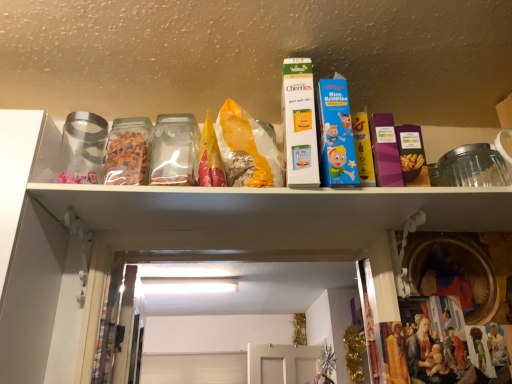
The height and width of the screenshot is (384, 512). I want to click on white cardboard cheerios box at upper center, which is the first product in left-to-right order, so click(298, 124).

Where is `blue cardboard rice krispies cereal box at center, which is the second product in left-to-right order`? The height and width of the screenshot is (384, 512). blue cardboard rice krispies cereal box at center, which is the second product in left-to-right order is located at coordinates (336, 134).

Locate an element on the screen. white cardboard cheerios box at upper center, marked as the second product in a right-to-left arrangement is located at coordinates (298, 124).

Is blue cardboard rice krispies cereal box at center, which is the second product in left-to-right order, placed right next to transparent plastic container at center?

There is a gap between blue cardboard rice krispies cereal box at center, which is the second product in left-to-right order, and transparent plastic container at center.

From their relative heights in the image, would you say blue cardboard rice krispies cereal box at center, which is the second product in left-to-right order, is taller or shorter than transparent plastic container at center?

blue cardboard rice krispies cereal box at center, which is the second product in left-to-right order, is taller than transparent plastic container at center.

Considering the sizes of blue cardboard rice krispies cereal box at center, the 1th product viewed from the right, and transparent plastic container at center in the image, is blue cardboard rice krispies cereal box at center, the 1th product viewed from the right, wider or thinner than transparent plastic container at center?

Clearly, blue cardboard rice krispies cereal box at center, the 1th product viewed from the right, has less width compared to transparent plastic container at center.

Measure the distance between blue cardboard rice krispies cereal box at center, the 1th product viewed from the right, and transparent plastic container at center.

15.10 inches.

Can you confirm if blue cardboard rice krispies cereal box at center, which is the second product in left-to-right order, is shorter than white cardboard cheerios box at upper center, which is the first product in left-to-right order?

Yes, blue cardboard rice krispies cereal box at center, which is the second product in left-to-right order, is shorter than white cardboard cheerios box at upper center, which is the first product in left-to-right order.

From a real-world perspective, is blue cardboard rice krispies cereal box at center, which is the second product in left-to-right order, located beneath white cardboard cheerios box at upper center, which is the first product in left-to-right order?

Yes, from a real-world perspective, blue cardboard rice krispies cereal box at center, which is the second product in left-to-right order, is below white cardboard cheerios box at upper center, which is the first product in left-to-right order.

Which object is thinner, blue cardboard rice krispies cereal box at center, the 1th product viewed from the right, or white cardboard cheerios box at upper center, which is the first product in left-to-right order?

With smaller width is blue cardboard rice krispies cereal box at center, the 1th product viewed from the right.

Which is in front, point (340, 113) or point (315, 184)?

The point (315, 184) is in front.

Between white cardboard cheerios box at upper center, marked as the second product in a right-to-left arrangement, and transparent plastic container at center, which one appears on the right side from the viewer's perspective?

white cardboard cheerios box at upper center, marked as the second product in a right-to-left arrangement.

From a real-world perspective, which object stands above the other?

In real-world perspective, white cardboard cheerios box at upper center, which is the first product in left-to-right order, is above.

Which object is more forward, white cardboard cheerios box at upper center, which is the first product in left-to-right order, or transparent plastic container at center?

white cardboard cheerios box at upper center, which is the first product in left-to-right order, is closer to the camera.

Is white cardboard cheerios box at upper center, marked as the second product in a right-to-left arrangement, placed right next to transparent plastic container at center?

white cardboard cheerios box at upper center, marked as the second product in a right-to-left arrangement, and transparent plastic container at center are not in contact.

In terms of height, does transparent plastic container at center look taller or shorter compared to blue cardboard rice krispies cereal box at center, the 1th product viewed from the right?

Considering their sizes, transparent plastic container at center has less height than blue cardboard rice krispies cereal box at center, the 1th product viewed from the right.

From the image's perspective, who appears lower, transparent plastic container at center or blue cardboard rice krispies cereal box at center, which is the second product in left-to-right order?

From the image's view, transparent plastic container at center is below.

From the picture: From a real-world perspective, is transparent plastic container at center physically above blue cardboard rice krispies cereal box at center, the 1th product viewed from the right?

No.

Is white cardboard cheerios box at upper center, which is the first product in left-to-right order, placed right next to blue cardboard rice krispies cereal box at center, which is the second product in left-to-right order?

Absolutely, white cardboard cheerios box at upper center, which is the first product in left-to-right order, is next to and touching blue cardboard rice krispies cereal box at center, which is the second product in left-to-right order.

Does white cardboard cheerios box at upper center, which is the first product in left-to-right order, turn towards blue cardboard rice krispies cereal box at center, the 1th product viewed from the right?

No, white cardboard cheerios box at upper center, which is the first product in left-to-right order, is not turned towards blue cardboard rice krispies cereal box at center, the 1th product viewed from the right.

Is white cardboard cheerios box at upper center, which is the first product in left-to-right order, to the left of blue cardboard rice krispies cereal box at center, which is the second product in left-to-right order, from the viewer's perspective?

Yes, white cardboard cheerios box at upper center, which is the first product in left-to-right order, is to the left of blue cardboard rice krispies cereal box at center, which is the second product in left-to-right order.

Does white cardboard cheerios box at upper center, which is the first product in left-to-right order, have a larger size compared to blue cardboard rice krispies cereal box at center, the 1th product viewed from the right?

Correct, white cardboard cheerios box at upper center, which is the first product in left-to-right order, is larger in size than blue cardboard rice krispies cereal box at center, the 1th product viewed from the right.

Can you see transparent plastic container at center touching white cardboard cheerios box at upper center, marked as the second product in a right-to-left arrangement?

No, transparent plastic container at center is not making contact with white cardboard cheerios box at upper center, marked as the second product in a right-to-left arrangement.

Considering the sizes of objects transparent plastic container at center and white cardboard cheerios box at upper center, which is the first product in left-to-right order, in the image provided, who is shorter, transparent plastic container at center or white cardboard cheerios box at upper center, which is the first product in left-to-right order,?

With less height is transparent plastic container at center.

You are a GUI agent. You are given a task and a screenshot of the screen. Output one action in this format:
    pyautogui.click(x=<x>, y=<y>)
    Task: Click on the glass jar below the white cardboard cheerios box at upper center, which is the first product in left-to-right order (from a real-world perspective)
    
    Given the screenshot: What is the action you would take?
    pyautogui.click(x=175, y=150)

Between transparent plastic container at center and white cardboard cheerios box at upper center, which is the first product in left-to-right order, which one is positioned behind?

transparent plastic container at center.

Locate an element on the screen. The height and width of the screenshot is (384, 512). the 2nd product to the right when counting from the transparent plastic container at center is located at coordinates (336, 134).

Where is `product on the left of blue cardboard rice krispies cereal box at center, which is the second product in left-to-right order`? Image resolution: width=512 pixels, height=384 pixels. product on the left of blue cardboard rice krispies cereal box at center, which is the second product in left-to-right order is located at coordinates (298, 124).

Based on their spatial positions, is white cardboard cheerios box at upper center, marked as the second product in a right-to-left arrangement, or transparent plastic container at center further from blue cardboard rice krispies cereal box at center, which is the second product in left-to-right order?

transparent plastic container at center is positioned further to the anchor blue cardboard rice krispies cereal box at center, which is the second product in left-to-right order.

From the picture: Estimate the real-world distances between objects in this image. Which object is closer to transparent plastic container at center, white cardboard cheerios box at upper center, which is the first product in left-to-right order, or blue cardboard rice krispies cereal box at center, which is the second product in left-to-right order?

white cardboard cheerios box at upper center, which is the first product in left-to-right order, is positioned closer to the anchor transparent plastic container at center.

Considering their positions, is transparent plastic container at center positioned further to blue cardboard rice krispies cereal box at center, which is the second product in left-to-right order, than white cardboard cheerios box at upper center, which is the first product in left-to-right order?

transparent plastic container at center is positioned further to the anchor blue cardboard rice krispies cereal box at center, which is the second product in left-to-right order.

Consider the image. Based on their spatial positions, is blue cardboard rice krispies cereal box at center, the 1th product viewed from the right, or white cardboard cheerios box at upper center, marked as the second product in a right-to-left arrangement, further from transparent plastic container at center?

Based on the image, blue cardboard rice krispies cereal box at center, the 1th product viewed from the right, appears to be further to transparent plastic container at center.

Which object lies further to the anchor point white cardboard cheerios box at upper center, which is the first product in left-to-right order, blue cardboard rice krispies cereal box at center, the 1th product viewed from the right, or transparent plastic container at center?

Based on the image, transparent plastic container at center appears to be further to white cardboard cheerios box at upper center, which is the first product in left-to-right order.

Estimate the real-world distances between objects in this image. Which object is closer to white cardboard cheerios box at upper center, marked as the second product in a right-to-left arrangement, transparent plastic container at center or blue cardboard rice krispies cereal box at center, which is the second product in left-to-right order?

The object closer to white cardboard cheerios box at upper center, marked as the second product in a right-to-left arrangement, is blue cardboard rice krispies cereal box at center, which is the second product in left-to-right order.

Where is `product between transparent plastic container at center and blue cardboard rice krispies cereal box at center, the 1th product viewed from the right, from left to right`? product between transparent plastic container at center and blue cardboard rice krispies cereal box at center, the 1th product viewed from the right, from left to right is located at coordinates (298, 124).